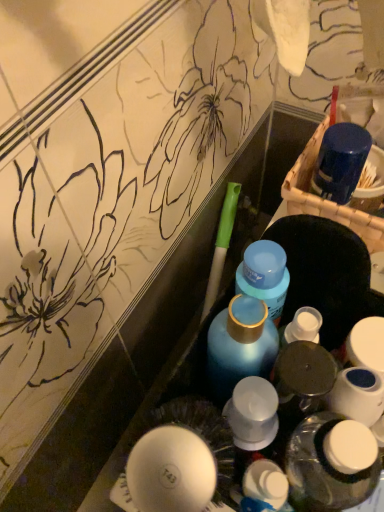
Question: Is white plastic bottle at center far away from blue matte bottle at center, which appears as the 2th bottle when ordered from the bottom?

Choices:
 (A) yes
 (B) no

Answer: (B)

Question: Is white plastic bottle at center in front of blue matte bottle at center, which appears as the 2th bottle when ordered from the bottom?

Choices:
 (A) yes
 (B) no

Answer: (A)

Question: From a real-world perspective, is white plastic bottle at center under blue matte bottle at center, arranged as the second bottle when viewed from the top?

Choices:
 (A) no
 (B) yes

Answer: (B)

Question: Could you tell me if white plastic bottle at center is facing blue matte bottle at center, which appears as the 2th bottle when ordered from the bottom?

Choices:
 (A) no
 (B) yes

Answer: (A)

Question: Is white plastic bottle at center turned away from blue matte bottle at center, arranged as the second bottle when viewed from the top?

Choices:
 (A) no
 (B) yes

Answer: (A)

Question: In the image, is blue matte bottle at center, which is the first bottle in top-to-bottom order, positioned in front of or behind blue matte bottle at center, arranged as the second bottle when viewed from the top?

Choices:
 (A) front
 (B) behind

Answer: (B)

Question: Is point (263, 280) positioned closer to the camera than point (276, 331)?

Choices:
 (A) closer
 (B) farther

Answer: (A)

Question: From a real-world perspective, is blue matte bottle at center, which is counted as the 3th bottle, starting from the bottom, positioned above or below blue matte bottle at center, which appears as the 2th bottle when ordered from the bottom?

Choices:
 (A) below
 (B) above

Answer: (A)

Question: Do you think blue matte bottle at center, which is counted as the 3th bottle, starting from the bottom, is within blue matte bottle at center, which appears as the 2th bottle when ordered from the bottom, or outside of it?

Choices:
 (A) outside
 (B) inside

Answer: (A)

Question: Relative to blue matte bottle at center, which appears as the 2th bottle when ordered from the bottom, is white plastic bottle at center in front or behind?

Choices:
 (A) behind
 (B) front

Answer: (B)

Question: Considering the relative positions of white plastic bottle at center and blue matte bottle at center, which appears as the 2th bottle when ordered from the bottom, in the image provided, is white plastic bottle at center to the left or to the right of blue matte bottle at center, which appears as the 2th bottle when ordered from the bottom,?

Choices:
 (A) left
 (B) right

Answer: (B)

Question: From the image's perspective, relative to blue matte bottle at center, arranged as the second bottle when viewed from the top, is white plastic bottle at center above or below?

Choices:
 (A) below
 (B) above

Answer: (A)

Question: Considering the positions of white plastic bottle at center and blue matte bottle at center, arranged as the second bottle when viewed from the top, in the image, is white plastic bottle at center wider or thinner than blue matte bottle at center, arranged as the second bottle when viewed from the top,?

Choices:
 (A) wide
 (B) thin

Answer: (B)

Question: In terms of width, does blue matte bottle at center, which is the first bottle in top-to-bottom order, look wider or thinner when compared to white plastic bottle at center, arranged as the third bottle when viewed from the top?

Choices:
 (A) thin
 (B) wide

Answer: (A)

Question: Is blue matte bottle at center, which is the first bottle in top-to-bottom order, bigger or smaller than white plastic bottle at center, arranged as the third bottle when viewed from the top?

Choices:
 (A) big
 (B) small

Answer: (B)